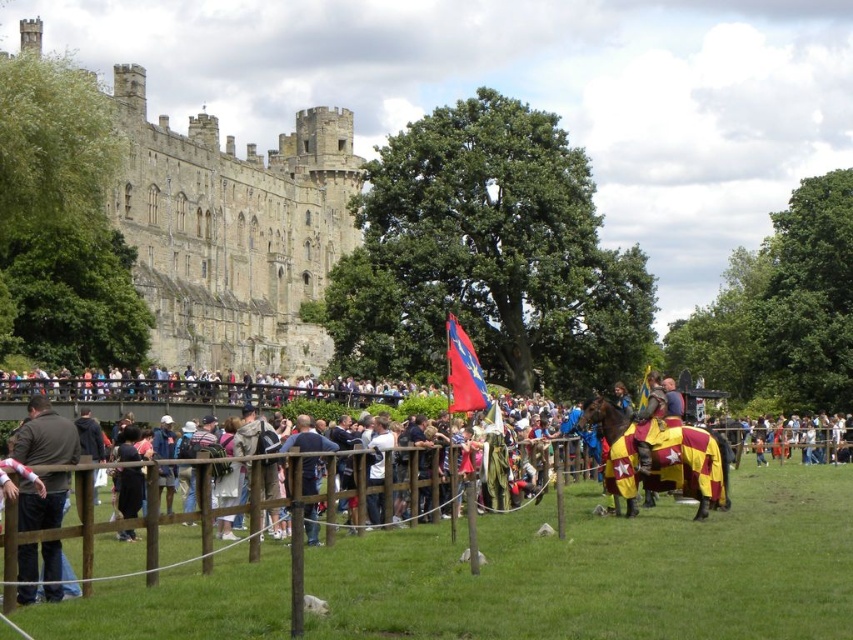
Question: Is stone medieval castle at left smaller than blue denim jeans at center?

Choices:
 (A) yes
 (B) no

Answer: (B)

Question: Does stone medieval castle at left appear under dark brown leather jacket at lower left?

Choices:
 (A) no
 (B) yes

Answer: (A)

Question: Which point appears closest to the camera in this image?

Choices:
 (A) (55, 561)
 (B) (471, 396)

Answer: (A)

Question: Which point appears closest to the camera in this image?

Choices:
 (A) (74, 445)
 (B) (361, 592)
 (C) (316, 508)
 (D) (450, 317)

Answer: (B)

Question: Estimate the real-world distances between objects in this image. Which object is closer to the wooden fence at center?

Choices:
 (A) stone medieval castle at left
 (B) dark brown leather jacket at lower left

Answer: (B)

Question: Is dark brown leather jacket at lower left smaller than red satin flag at center?

Choices:
 (A) no
 (B) yes

Answer: (A)